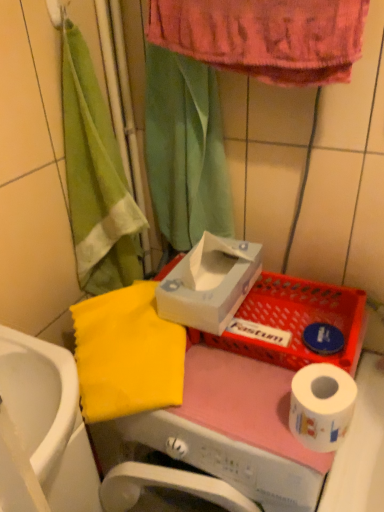
Question: Considering the relative sizes of white glossy sink at lower left and green fabric shower curtain at upper center in the image provided, is white glossy sink at lower left smaller than green fabric shower curtain at upper center?

Choices:
 (A) yes
 (B) no

Answer: (B)

Question: Considering the relative positions of white glossy sink at lower left and green fabric shower curtain at upper center in the image provided, is white glossy sink at lower left to the left of green fabric shower curtain at upper center from the viewer's perspective?

Choices:
 (A) no
 (B) yes

Answer: (B)

Question: Is green fabric shower curtain at upper center inside white glossy sink at lower left?

Choices:
 (A) yes
 (B) no

Answer: (B)

Question: From the image's perspective, would you say white glossy sink at lower left is shown under green fabric shower curtain at upper center?

Choices:
 (A) yes
 (B) no

Answer: (A)

Question: Is white glossy sink at lower left not near green fabric shower curtain at upper center?

Choices:
 (A) yes
 (B) no

Answer: (B)

Question: Visually, is yellow fabric at left positioned to the left or to the right of white cardboard tissue box at center?

Choices:
 (A) right
 (B) left

Answer: (B)

Question: From the image's perspective, is yellow fabric at left positioned above or below white cardboard tissue box at center?

Choices:
 (A) above
 (B) below

Answer: (B)

Question: Is yellow fabric at left situated inside white cardboard tissue box at center or outside?

Choices:
 (A) outside
 (B) inside

Answer: (A)

Question: Relative to white cardboard tissue box at center, is yellow fabric at left in front or behind?

Choices:
 (A) behind
 (B) front

Answer: (B)

Question: Does point (61, 354) appear closer or farther from the camera than point (213, 142)?

Choices:
 (A) farther
 (B) closer

Answer: (B)

Question: From a real-world perspective, relative to green fabric shower curtain at upper center, is white glossy sink at lower left vertically above or below?

Choices:
 (A) below
 (B) above

Answer: (A)

Question: Would you say white glossy sink at lower left is to the left or to the right of green fabric shower curtain at upper center in the picture?

Choices:
 (A) right
 (B) left

Answer: (B)

Question: Would you say white glossy sink at lower left is inside or outside green fabric shower curtain at upper center?

Choices:
 (A) outside
 (B) inside

Answer: (A)

Question: Is white cardboard tissue box at center taller or shorter than green fabric shower curtain at upper center?

Choices:
 (A) tall
 (B) short

Answer: (B)

Question: From a real-world perspective, relative to green fabric shower curtain at upper center, is white cardboard tissue box at center vertically above or below?

Choices:
 (A) below
 (B) above

Answer: (A)